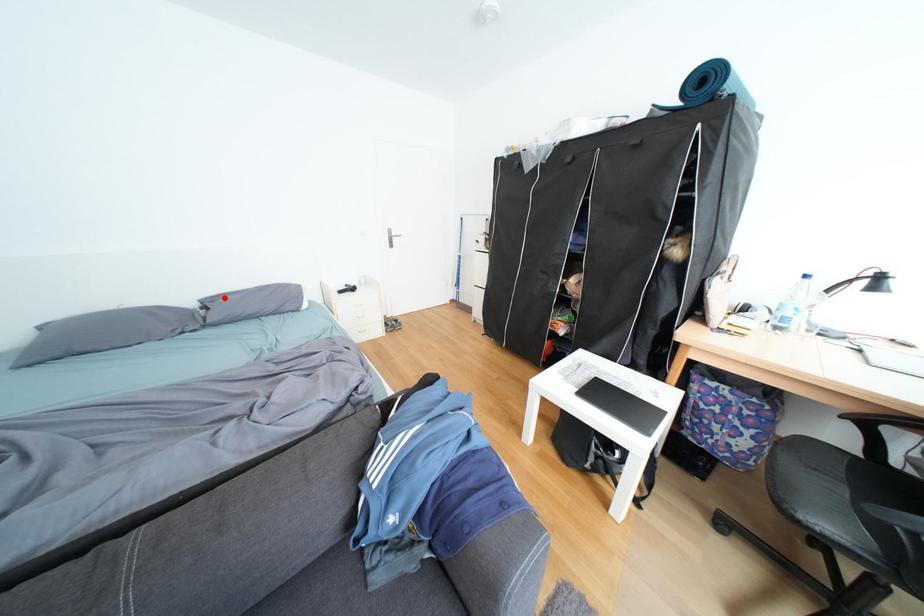
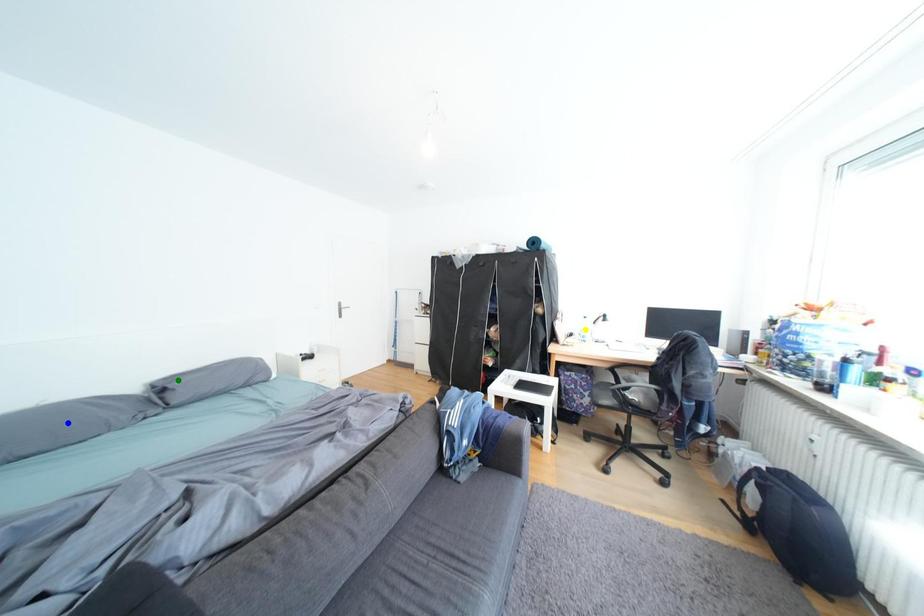
Question: I am providing you with two images of the same scene from different viewpoints. A red point is marked on the first image. You are given multiple points on the second image. Which mark in image 2 goes with the point in image 1?

Choices:
 (A) green point
 (B) yellow point
 (C) blue point

Answer: (A)